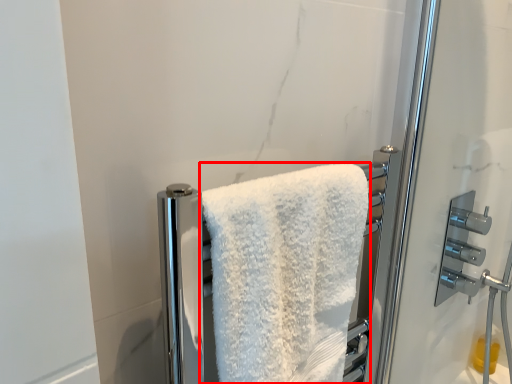
Question: From the image, what is the correct spatial relationship of towel (annotated by the red box) in relation to door handle?

Choices:
 (A) right
 (B) left

Answer: (B)